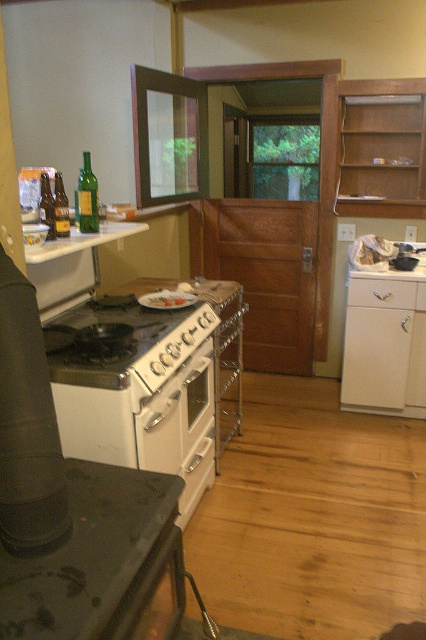
Question: Among these points, which one is farthest from the camera?

Choices:
 (A) (181, 292)
 (B) (158, 298)
 (C) (11, 544)

Answer: (A)

Question: Does white glossy gas stove at center have a larger size compared to white glossy plate at center?

Choices:
 (A) yes
 (B) no

Answer: (A)

Question: Does white enamel oven at center appear over white glossy plate at center?

Choices:
 (A) no
 (B) yes

Answer: (A)

Question: Estimate the real-world distances between objects in this image. Which object is farther from the white matte plate at center?

Choices:
 (A) white glossy gas stove at center
 (B) black matte exhaust hood at lower left
 (C) white enamel oven at center

Answer: (B)

Question: Can you confirm if black matte exhaust hood at lower left is positioned to the right of white glossy gas stove at center?

Choices:
 (A) no
 (B) yes

Answer: (B)

Question: Which point is closer to the camera?

Choices:
 (A) white matte plate at center
 (B) white glossy plate at center

Answer: (A)